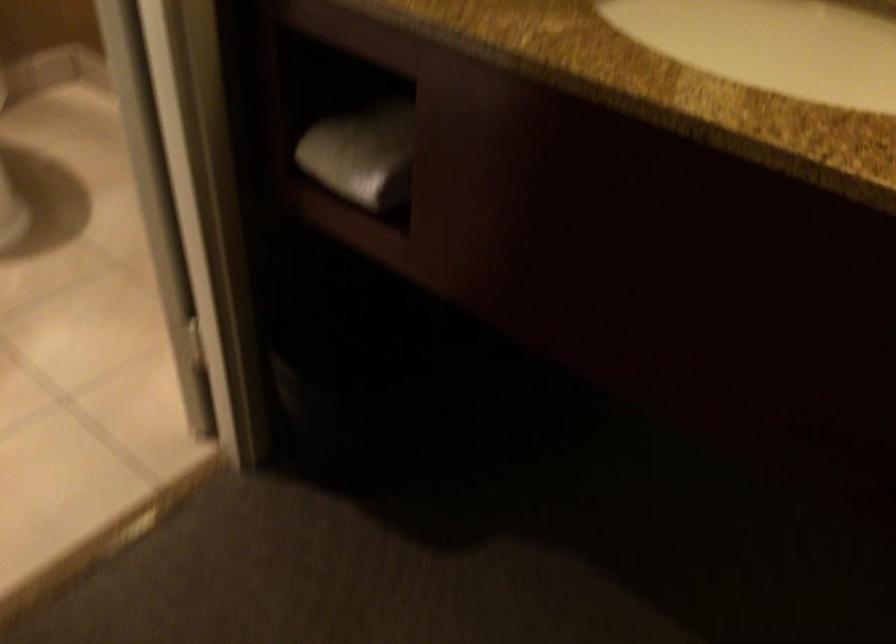
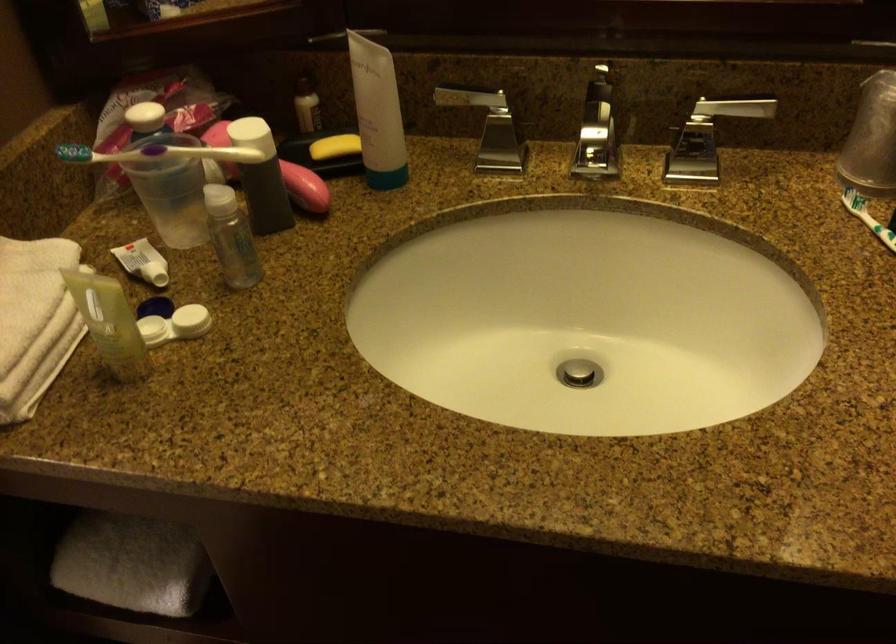
Question: The images are taken continuously from a first-person perspective. In which direction is your viewpoint rotating?

Choices:
 (A) Left
 (B) Right
 (C) Up
 (D) Down

Answer: (B)